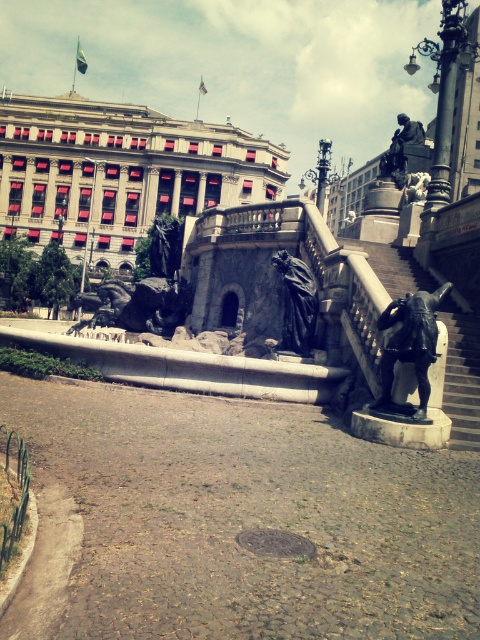
Does black stone stairs at center right appear on the right side of black polished statue at center?

Indeed, black stone stairs at center right is positioned on the right side of black polished statue at center.

Which is more to the right, black stone stairs at center right or black polished statue at center?

Positioned to the right is black stone stairs at center right.

Image resolution: width=480 pixels, height=640 pixels. In order to click on black stone stairs at center right in this screenshot , I will do `click(462, 376)`.

Where is `black stone stairs at center right`? black stone stairs at center right is located at coordinates (462, 376).

Who is higher up, matte red building at upper left or black polished stone statue at center?

matte red building at upper left is above.

Describe the element at coordinates (119, 172) in the screenshot. I see `matte red building at upper left` at that location.

Which is behind, point (148, 177) or point (298, 292)?

The point (148, 177) is more distant.

I want to click on matte red building at upper left, so click(119, 172).

Can you confirm if black polished statue at center is wider than black polished stone statue at center?

Indeed, black polished statue at center has a greater width compared to black polished stone statue at center.

From the picture: Can you confirm if black polished statue at center is taller than black polished stone statue at center?

In fact, black polished statue at center may be shorter than black polished stone statue at center.

This screenshot has height=640, width=480. Find the location of `black polished statue at center`. black polished statue at center is located at coordinates (410, 342).

Locate an element on the screen. Image resolution: width=480 pixels, height=640 pixels. black polished statue at center is located at coordinates (410, 342).